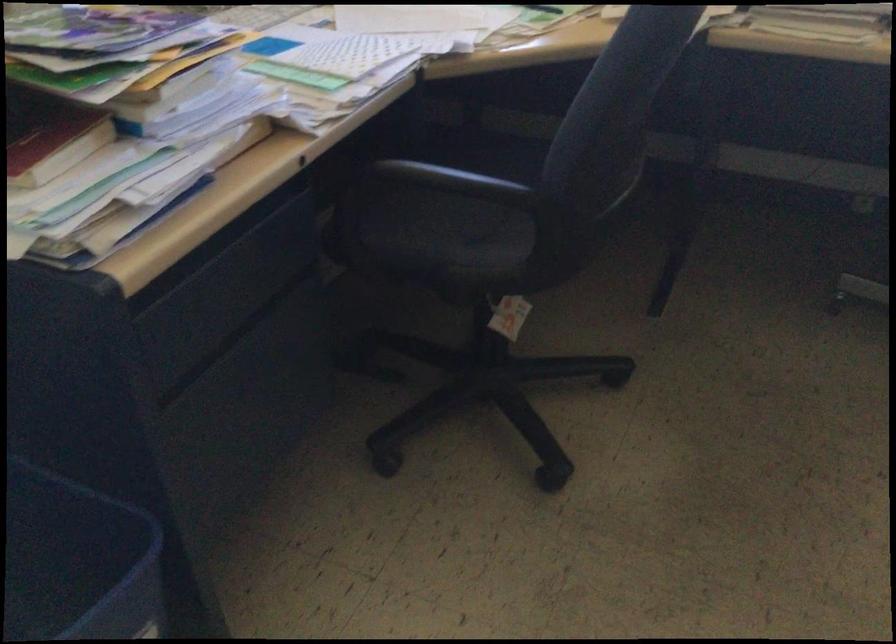
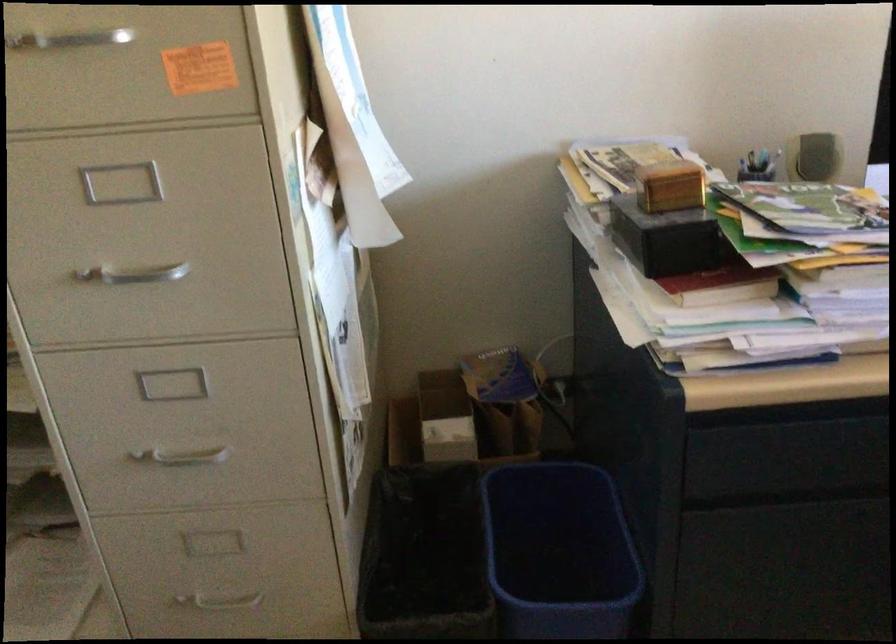
Question: Based on the continuous images, in which direction is the camera rotating? Reply with the corresponding letter.

Choices:
 (A) Left
 (B) Right
 (C) Up
 (D) Down

Answer: (A)